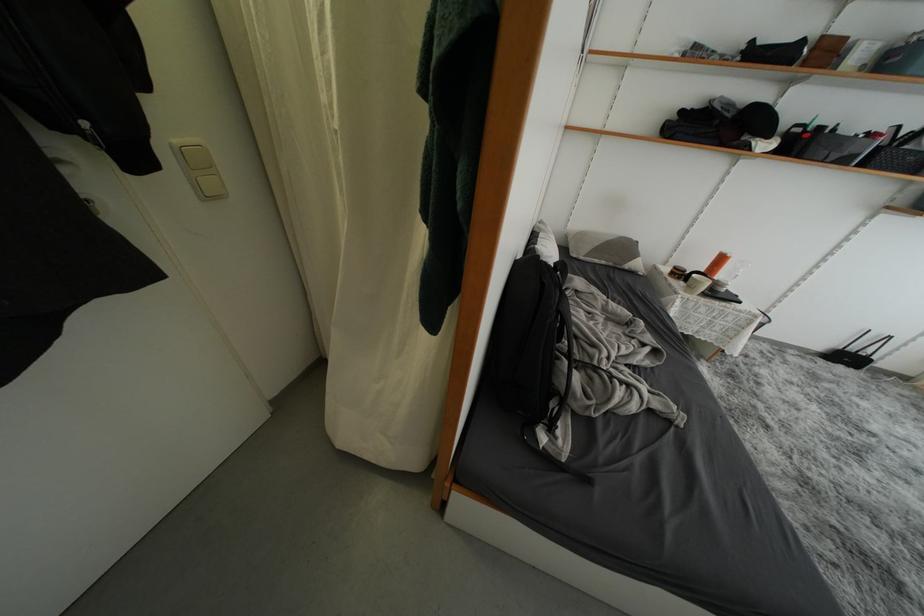
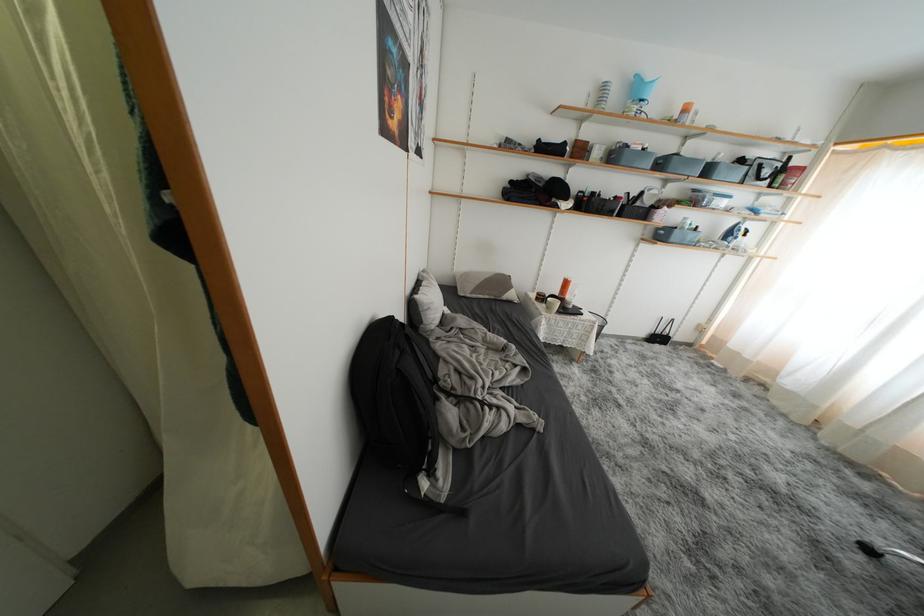
Locate, in the second image, the point that corresponds to the point at 564,297 in the first image.

(404, 357)